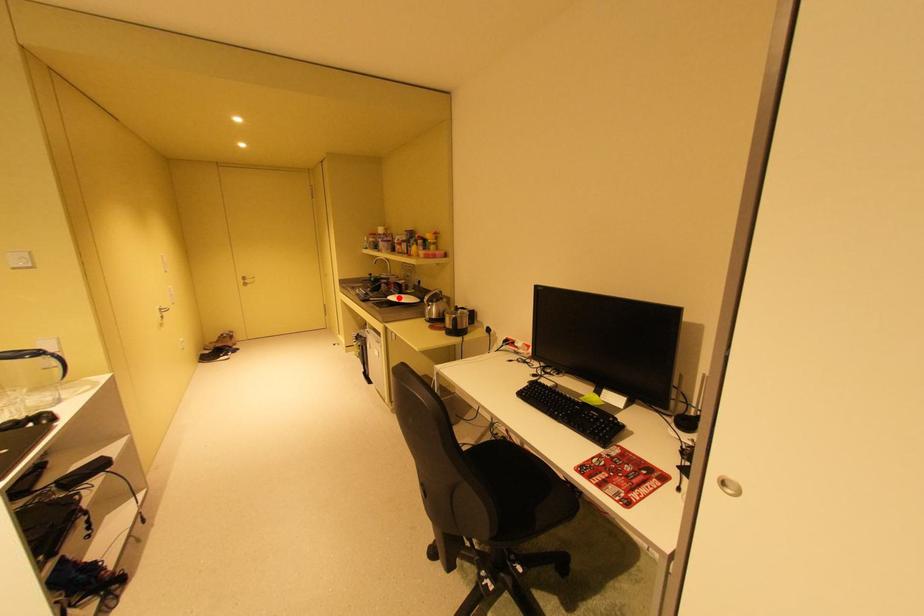
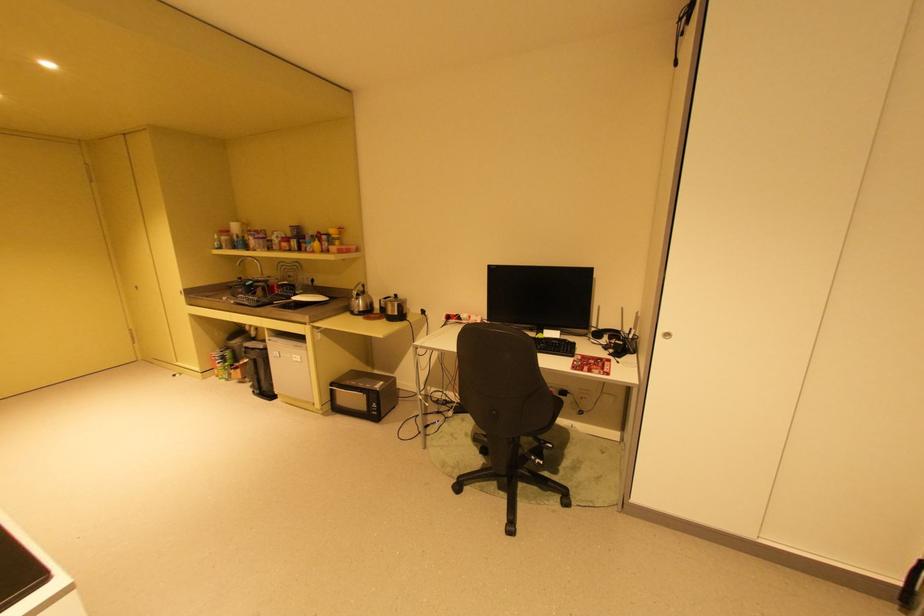
The point at the highlighted location is marked in the first image. Where is the corresponding point in the second image?

(304, 299)